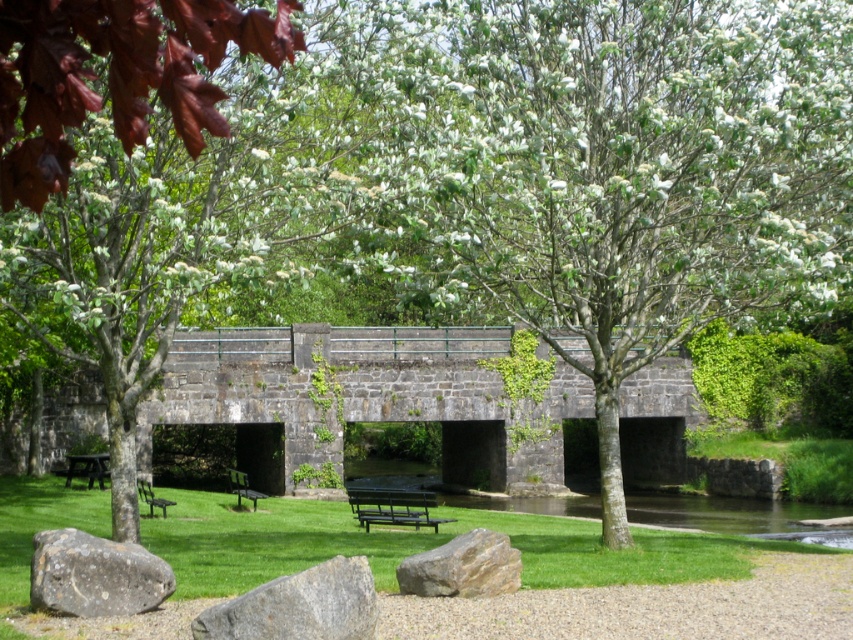
Question: Which object is closer to the camera taking this photo?

Choices:
 (A) wooden park bench at lower left
 (B) green grass at lower center
 (C) gray rough rock at lower left

Answer: (B)

Question: Can you confirm if gray rough rock at lower center is positioned to the left of gray rough rock at lower left?

Choices:
 (A) yes
 (B) no

Answer: (B)

Question: Among these objects, which one is farthest from the camera?

Choices:
 (A) gray rough rock at lower left
 (B) gray rough rock at lower center
 (C) black wood bench at center

Answer: (C)

Question: Which point is closer to the camera?

Choices:
 (A) green grass at lower center
 (B) brown rough boulder at center
 (C) stone bridge at center

Answer: (A)

Question: Can you confirm if gray rough rock at lower center is wider than gray rough rock at lower left?

Choices:
 (A) yes
 (B) no

Answer: (B)

Question: Where is wooden park bench at center located in relation to green painted wood bench at lower left in the image?

Choices:
 (A) right
 (B) left

Answer: (A)